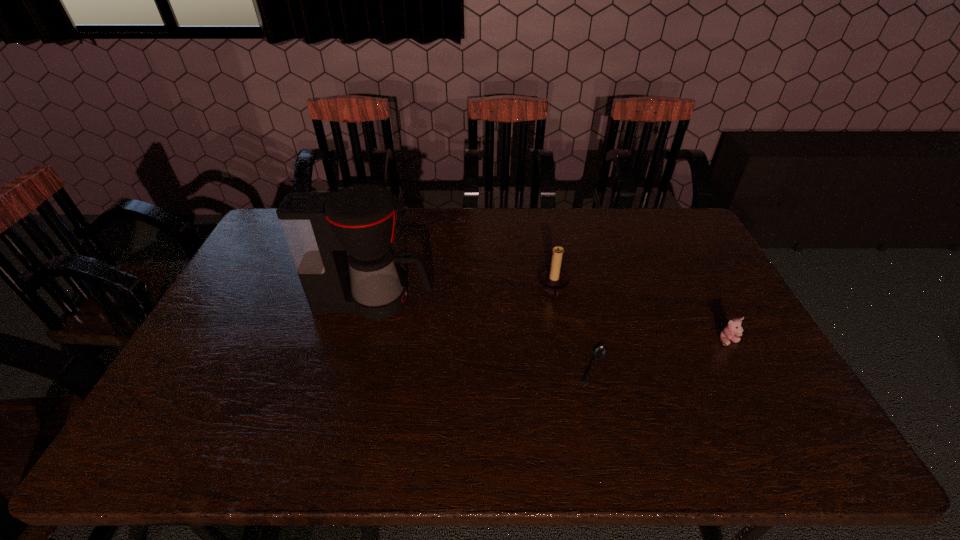
You are a GUI agent. You are given a task and a screenshot of the screen. Output one action in this format:
    pyautogui.click(x=<x>, y=<y>)
    Task: Click on the free space located on the wick of the candle holder
    
    Given the screenshot: What is the action you would take?
    (x=475, y=289)

Locate an element on the screen. The width and height of the screenshot is (960, 540). vacant space located at the face of the teddy bear is located at coordinates (786, 448).

Where is `vacant position located on the right of the soupspoon`? vacant position located on the right of the soupspoon is located at coordinates (642, 367).

Image resolution: width=960 pixels, height=540 pixels. What are the coordinates of `object that is at the right edge` in the screenshot? It's located at (733, 330).

You are a GUI agent. You are given a task and a screenshot of the screen. Output one action in this format:
    pyautogui.click(x=<x>, y=<y>)
    Task: Click on the vacant area at the far edge of the desktop
    Image resolution: width=960 pixels, height=540 pixels.
    Given the screenshot: What is the action you would take?
    pyautogui.click(x=406, y=230)

Locate an element on the screen. This screenshot has height=540, width=960. vacant space at the near edge is located at coordinates (291, 449).

Where is `vacant space at the left edge of the desktop`? vacant space at the left edge of the desktop is located at coordinates click(243, 318).

In the image, there is a desktop. Where is `vacant space at the right edge`? vacant space at the right edge is located at coordinates (698, 276).

This screenshot has width=960, height=540. I want to click on free space at the far right corner, so click(x=671, y=235).

In the image, there is a desktop. Where is `vacant space at the near right corner`? This screenshot has height=540, width=960. vacant space at the near right corner is located at coordinates (807, 460).